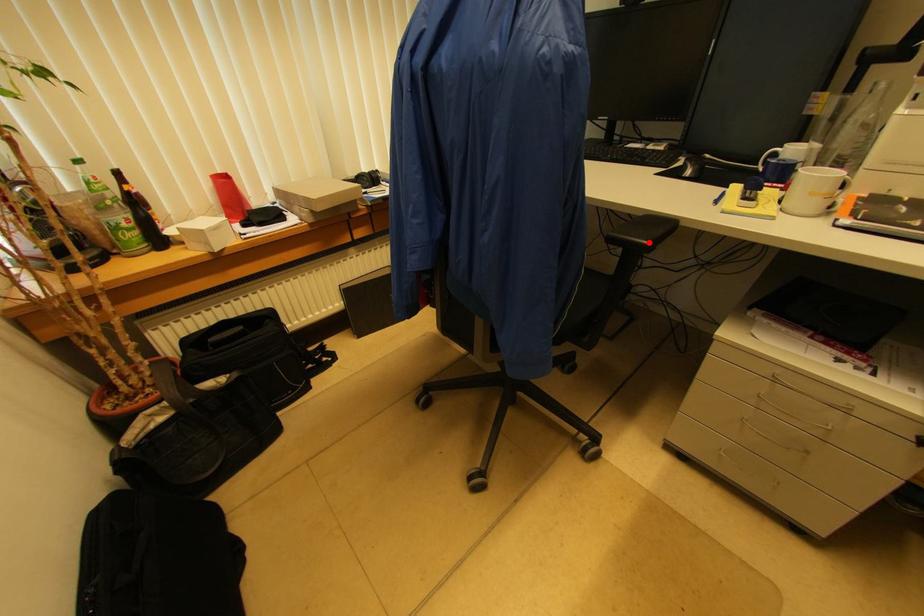
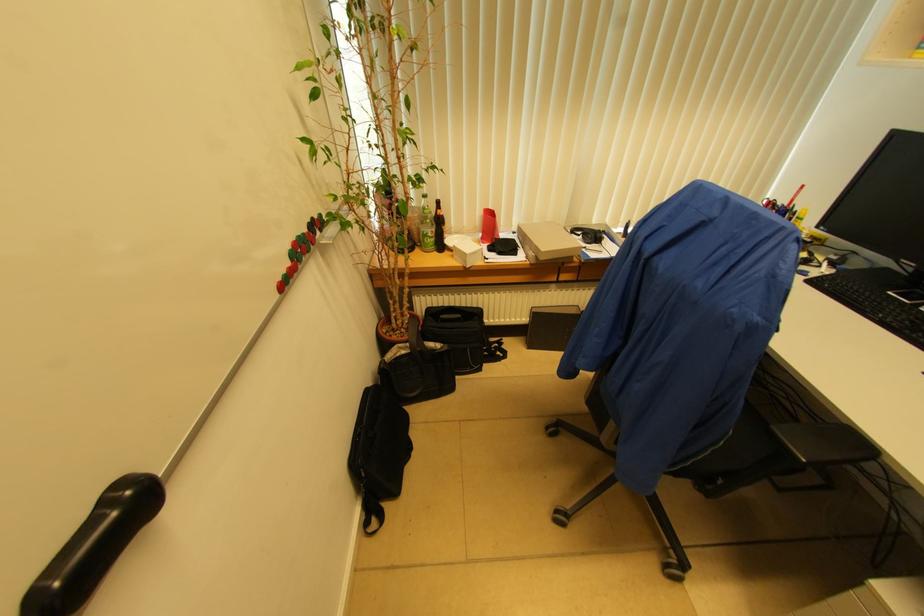
Where in the second image is the point corresponding to the highlighted location from the first image?

(807, 461)